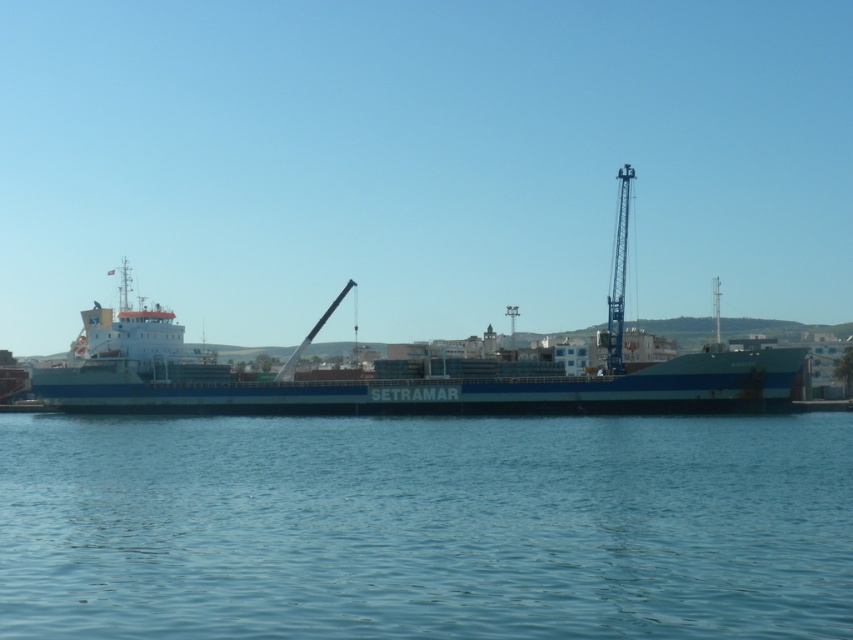
Is blue liquid water at center taller than blue matte cargo ship at center?

No.

Does blue liquid water at center have a larger size compared to blue matte cargo ship at center?

No, blue liquid water at center is not bigger than blue matte cargo ship at center.

What do you see at coordinates (425, 525) in the screenshot? The width and height of the screenshot is (853, 640). I see `blue liquid water at center` at bounding box center [425, 525].

You are a GUI agent. You are given a task and a screenshot of the screen. Output one action in this format:
    pyautogui.click(x=<x>, y=<y>)
    Task: Click on the blue liquid water at center
    
    Given the screenshot: What is the action you would take?
    pyautogui.click(x=425, y=525)